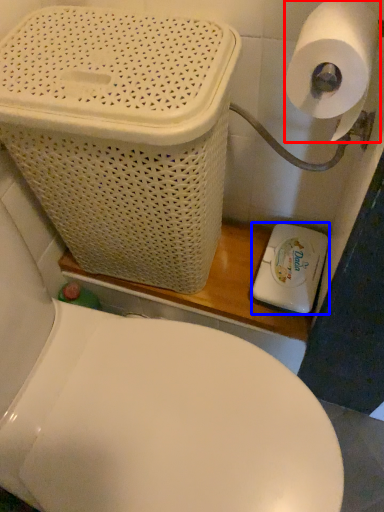
Question: Which point is further to the camera, toilet paper (highlighted by a red box) or appliance (highlighted by a blue box)?

Choices:
 (A) toilet paper
 (B) appliance

Answer: (B)